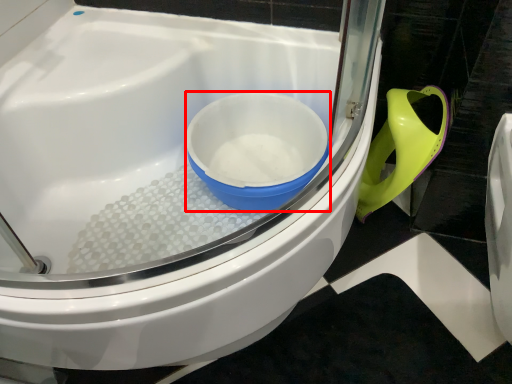
Question: From the image's perspective, what is the correct spatial positioning of mixing bowl (annotated by the red box) in reference to toilet?

Choices:
 (A) above
 (B) below

Answer: (A)